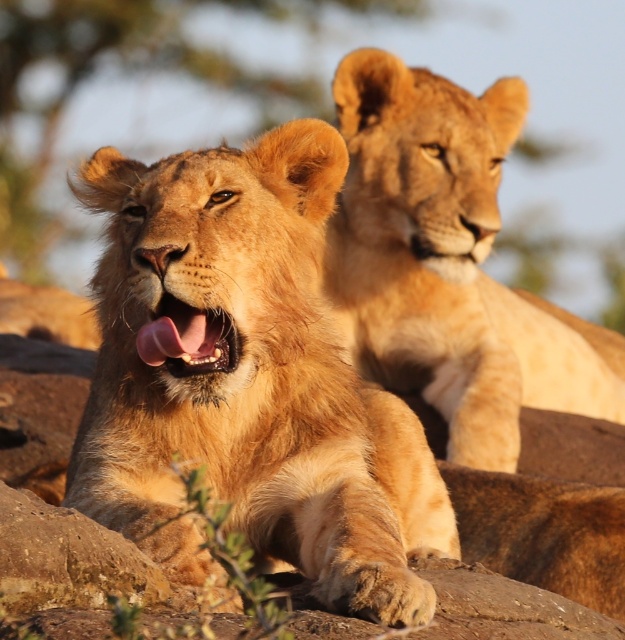
You are a wildlife photographer trying to capture a closeup of the golden fur lion at center. Your camera has a focus point at coordinate point (251, 381). Is this focus point correctly positioned to capture the golden fur lion at center?

The golden fur lion at center is located at point (251, 381), so yes, the focus point at coordinate point (251, 381) is correctly positioned to capture the golden fur lion at center.

You are a wildlife photographer aiming to capture a closeup of the golden fur lion at upper center. Based on its coordinates at point 0.411, 0.718, where should you position your camera relative to the frame?

The golden fur lion at upper center is located at coordinates point (x=448, y=262), which means it is positioned slightly to the left and lower middle of the frame. To capture a closeup, you should position your camera focused on that coordinate point.

You are a wildlife photographer trying to capture a closeup of the golden fur lion at center and the pink glossy tongue at center. Which one should you focus on first if you want to ensure both are in focus?

The golden fur lion at center is in front of the pink glossy tongue at center, so you should focus on the golden fur lion at center first to ensure both are in focus.